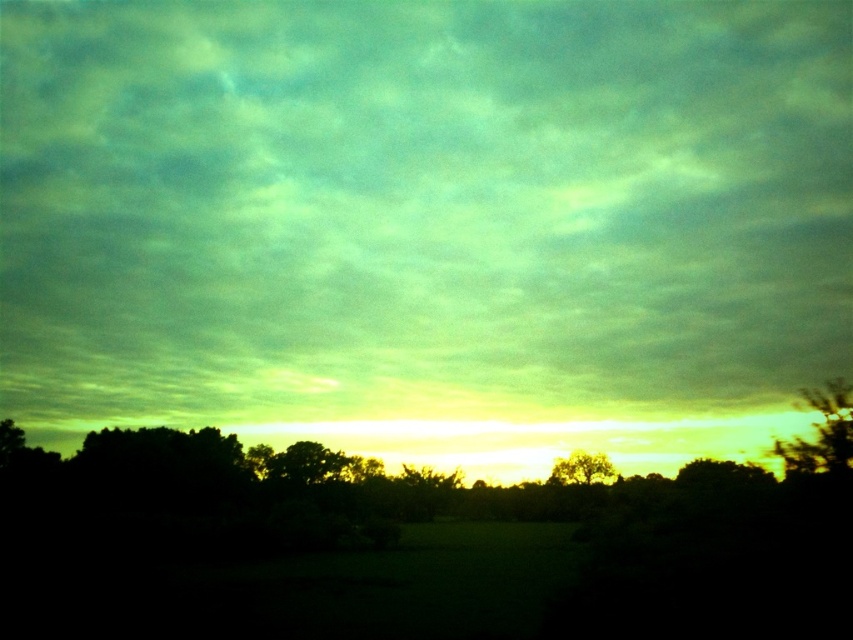
Is silvery metallic tree at right closer to camera compared to golden textured tree at center?

Yes, it is.

Locate an element on the screen. This screenshot has width=853, height=640. silvery metallic tree at right is located at coordinates (821, 433).

Can you confirm if green matte cloud at upper center is positioned below silvery metallic tree at right?

Yes, green matte cloud at upper center is below silvery metallic tree at right.

Is green matte cloud at upper center further to the viewer compared to silvery metallic tree at right?

Yes.

Is point (44, 0) positioned behind point (838, 440)?

Yes, point (44, 0) is farther from viewer.

The width and height of the screenshot is (853, 640). Find the location of `green matte cloud at upper center`. green matte cloud at upper center is located at coordinates (427, 224).

Between green matte cloud at upper center and golden textured tree at center, which one appears on the left side from the viewer's perspective?

Positioned to the left is green matte cloud at upper center.

Does green matte cloud at upper center have a smaller size compared to golden textured tree at center?

No.

You are a GUI agent. You are given a task and a screenshot of the screen. Output one action in this format:
    pyautogui.click(x=<x>, y=<y>)
    Task: Click on the green matte cloud at upper center
    This screenshot has height=640, width=853.
    Given the screenshot: What is the action you would take?
    pyautogui.click(x=427, y=224)

Identify the location of green matte cloud at upper center. (427, 224).